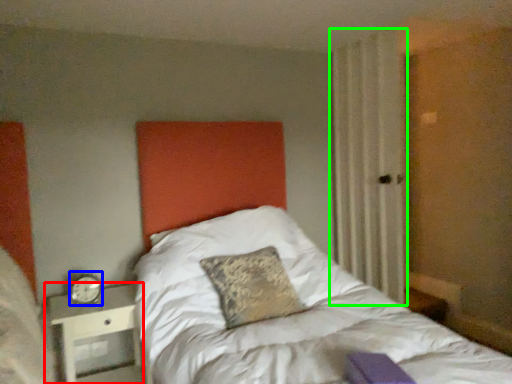
Question: Considering the real-world distances, which object is closest to nightstand (highlighted by a red box)? alarm clock (highlighted by a blue box) or curtain (highlighted by a green box).

Choices:
 (A) alarm clock
 (B) curtain

Answer: (A)